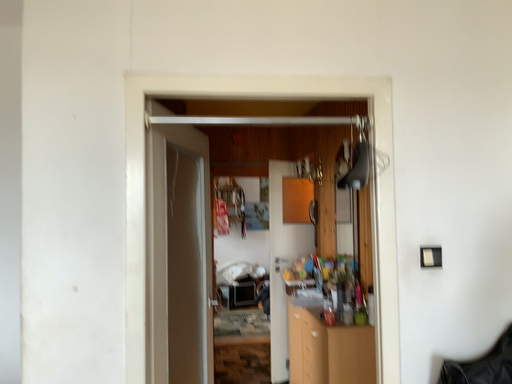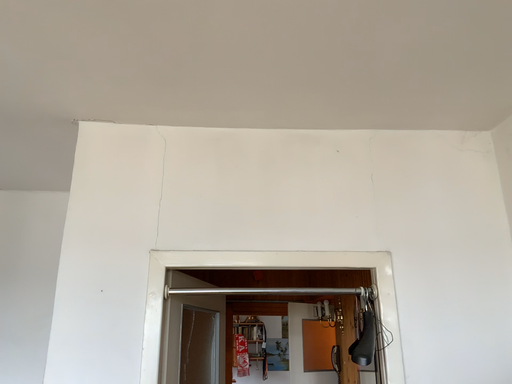
Question: Which way did the camera rotate in the video?

Choices:
 (A) rotated downward
 (B) rotated upward

Answer: (B)